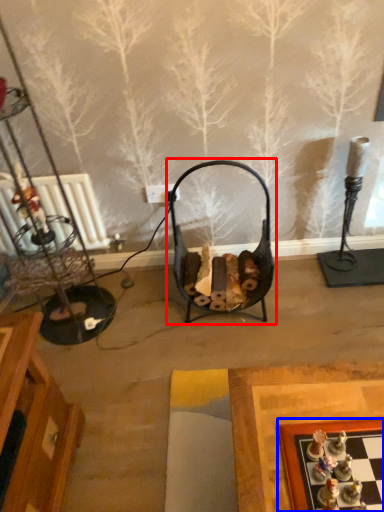
Question: Which object appears farthest to the camera in this image, swivel chair (highlighted by a red box) or board game (highlighted by a blue box)?

Choices:
 (A) swivel chair
 (B) board game

Answer: (A)